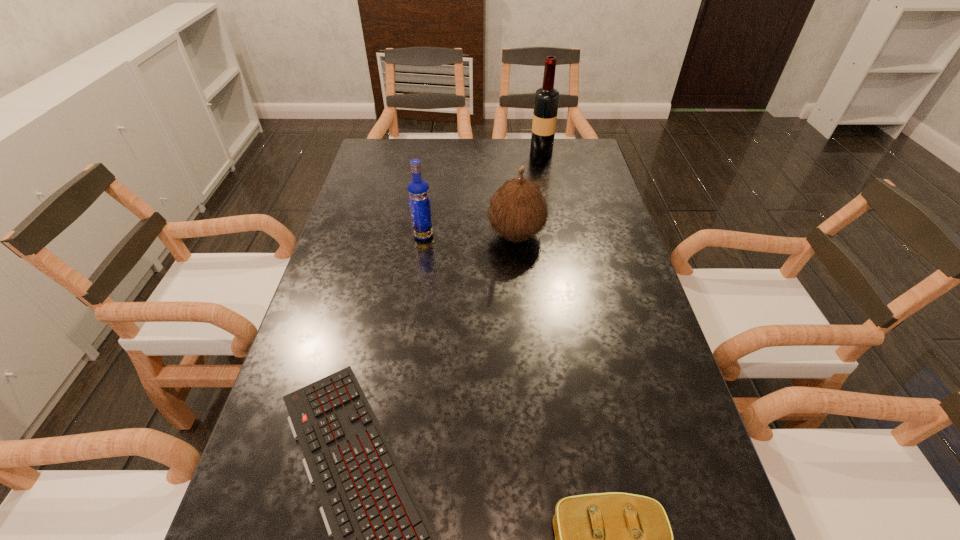
Locate an element on the screen. The height and width of the screenshot is (540, 960). the tallest object is located at coordinates (546, 101).

The height and width of the screenshot is (540, 960). Identify the location of wine bottle. (546, 101).

The width and height of the screenshot is (960, 540). Find the location of `coconut`. coconut is located at coordinates (517, 210).

You are a GUI agent. You are given a task and a screenshot of the screen. Output one action in this format:
    pyautogui.click(x=<x>, y=<y>)
    Task: Click on the vodka
    
    Given the screenshot: What is the action you would take?
    418,190

At what (x,y) coordinates should I click in order to perform the action: click on free point located on the front of the tallest object. Please return your answer as a coordinate pair (x, y). Looking at the image, I should click on (545, 178).

Find the location of `vacant space situated 0.400m on the surface of the coconut`. vacant space situated 0.400m on the surface of the coconut is located at coordinates (348, 234).

The height and width of the screenshot is (540, 960). I want to click on free location located on the surface of the coconut, so click(x=427, y=234).

You are a GUI agent. You are given a task and a screenshot of the screen. Output one action in this format:
    pyautogui.click(x=<x>, y=<y>)
    Task: Click on the free location located on the surface of the coconut
    Image resolution: width=960 pixels, height=540 pixels.
    Given the screenshot: What is the action you would take?
    pyautogui.click(x=389, y=234)

The height and width of the screenshot is (540, 960). Identify the location of free space located 0.250m on the front of the vodka. (413, 308).

Image resolution: width=960 pixels, height=540 pixels. Identify the location of object positioned at the far edge. (546, 101).